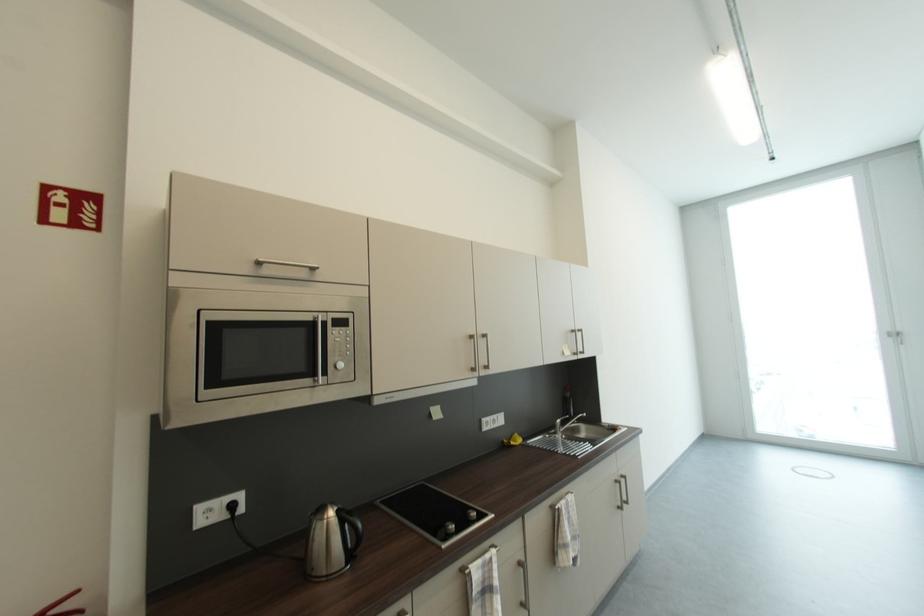
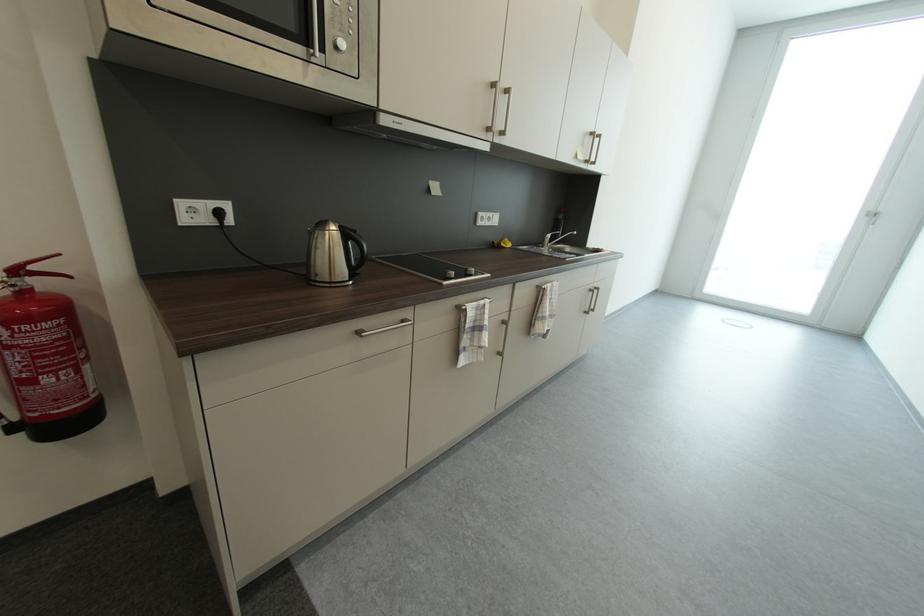
Locate, in the second image, the point that corresponds to (x=561, y=428) in the first image.

(550, 241)